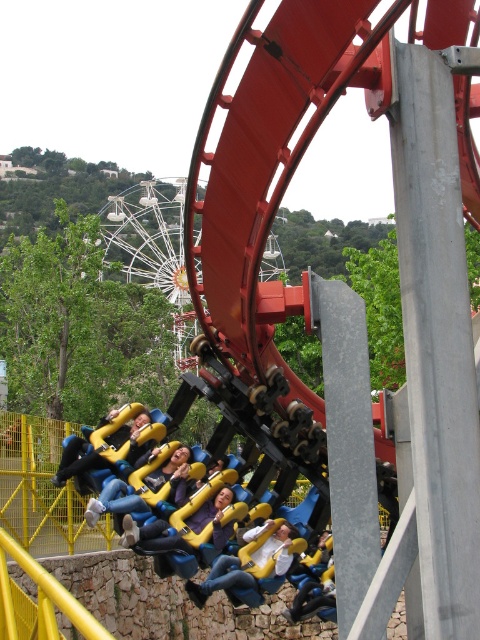
This screenshot has width=480, height=640. Describe the element at coordinates (220, 579) in the screenshot. I see `denim jeans at center` at that location.

Consider the image. Which is below, denim jeans at center or yellow fabric seat at center?

Positioned lower is denim jeans at center.

Where is `denim jeans at center`? denim jeans at center is located at coordinates (220, 579).

Is denim jeans at center bigger than yellow plastic helmet at center?

Indeed, denim jeans at center has a larger size compared to yellow plastic helmet at center.

Between denim jeans at center and yellow plastic helmet at center, which one has more height?

denim jeans at center

What are the coordinates of `denim jeans at center` in the screenshot? It's located at (220, 579).

Is point (276, 550) less distant than point (63, 451)?

Yes, point (276, 550) is closer to viewer.

Can you confirm if denim jeans at center is wider than yellow plastic seat at center?

Indeed, denim jeans at center has a greater width compared to yellow plastic seat at center.

Which is behind, point (207, 580) or point (119, 435)?

The point (119, 435) is behind.

Locate an element on the screen. The height and width of the screenshot is (640, 480). denim jeans at center is located at coordinates (220, 579).